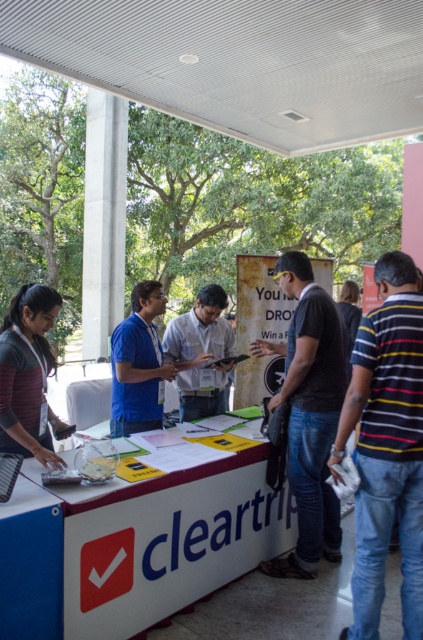
Question: Which object appears farthest from the camera in this image?

Choices:
 (A) metallic ceiling at upper center
 (B) dark blue shirt at center
 (C) blue matte shirt at center
 (D) striped cotton shirt at right

Answer: (C)

Question: Which point is closer to the camera taking this photo?

Choices:
 (A) (33, 547)
 (B) (183, 408)

Answer: (A)

Question: Is white plastic table at center smaller than concrete column at center?

Choices:
 (A) yes
 (B) no

Answer: (A)

Question: Considering the relative positions of striped sweater at left and light gray shirt at center in the image provided, where is striped sweater at left located with respect to light gray shirt at center?

Choices:
 (A) below
 (B) above

Answer: (B)

Question: Which object is farther from the camera taking this photo?

Choices:
 (A) striped sweater at left
 (B) striped cotton shirt at right
 (C) concrete column at center
 (D) light gray shirt at center

Answer: (C)

Question: Can you confirm if dark blue shirt at center is positioned to the right of blue matte shirt at center?

Choices:
 (A) yes
 (B) no

Answer: (A)